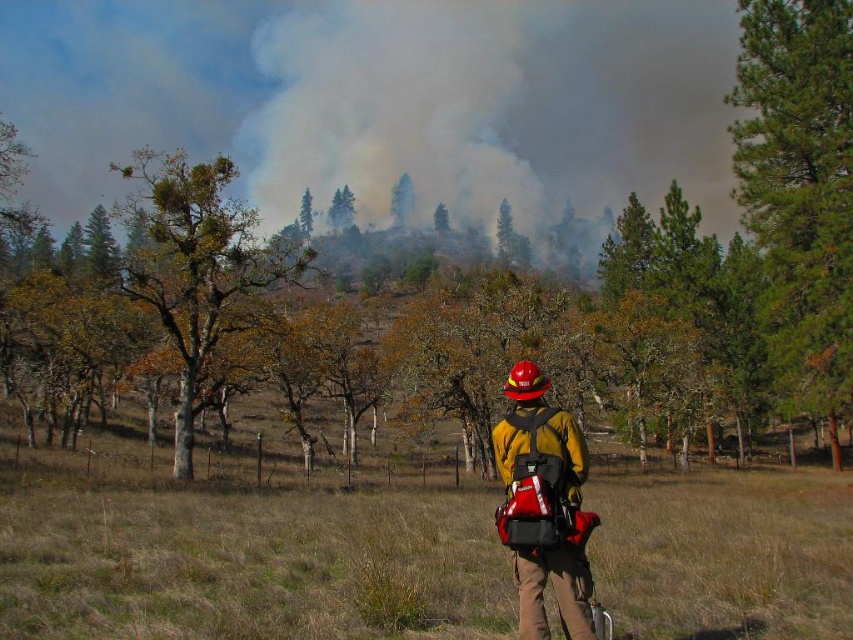
Question: Can you confirm if green leafy tree at left is positioned to the left of yellow matte fireman at center?

Choices:
 (A) no
 (B) yes

Answer: (B)

Question: Which point is closer to the camera taking this photo?

Choices:
 (A) [x=178, y=268]
 (B) [x=813, y=92]

Answer: (B)

Question: Observing the image, what is the correct spatial positioning of green leafy tree at left in reference to green leafy tree at upper center?

Choices:
 (A) right
 (B) left

Answer: (B)

Question: Which of the following is the closest to the observer?

Choices:
 (A) green matte tree at center
 (B) yellow matte fireman at center
 (C) green pine tree at right

Answer: (B)

Question: Which of the following is the closest to the observer?

Choices:
 (A) green pine tree at right
 (B) green matte tree at upper center

Answer: (A)

Question: Considering the relative positions of yellow matte fireman at center and green matte tree at center in the image provided, where is yellow matte fireman at center located with respect to green matte tree at center?

Choices:
 (A) above
 (B) below

Answer: (B)